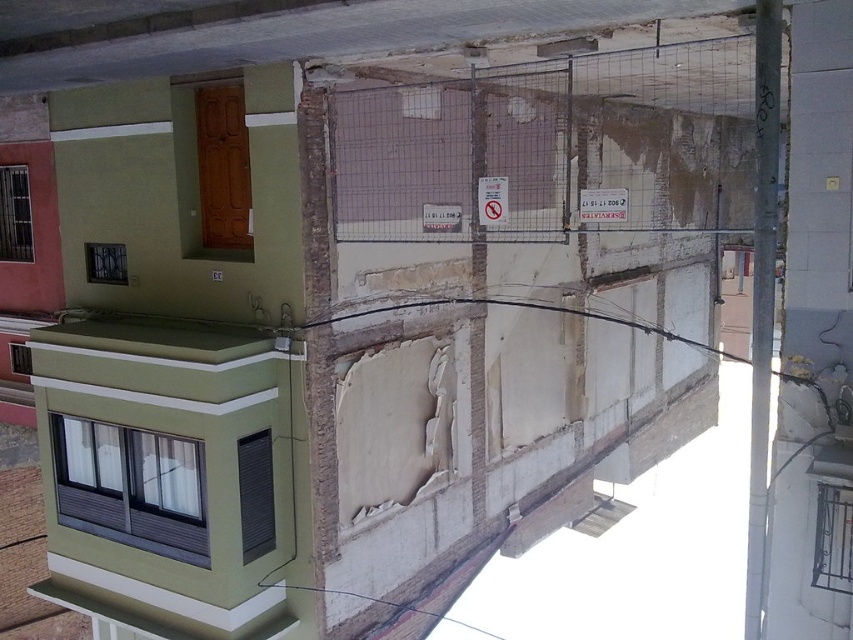
You are a delivery person trying to read two signs in the middle of the image. The signs are labeled as the white paper sign at center and the white plastic sign at center. Which one is shorter?

The white paper sign at center is shorter than the white plastic sign at center.

You are a delivery person trying to read two signs on a building. You see a white paper sign at center and a white plastic sign at center. Which sign is easier to see from your current position?

The white paper sign at center is in front of the white plastic sign at center, so it is easier to see from your current position.